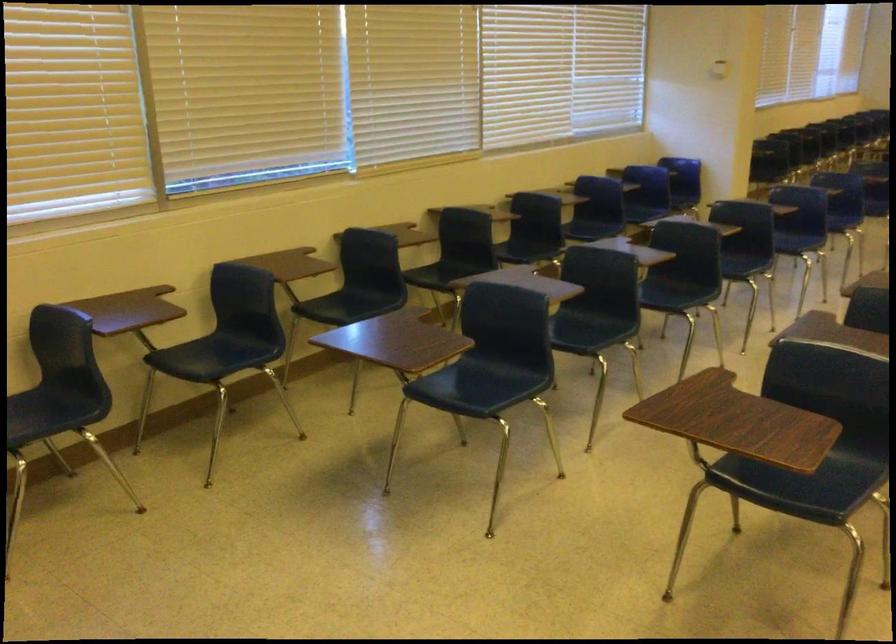
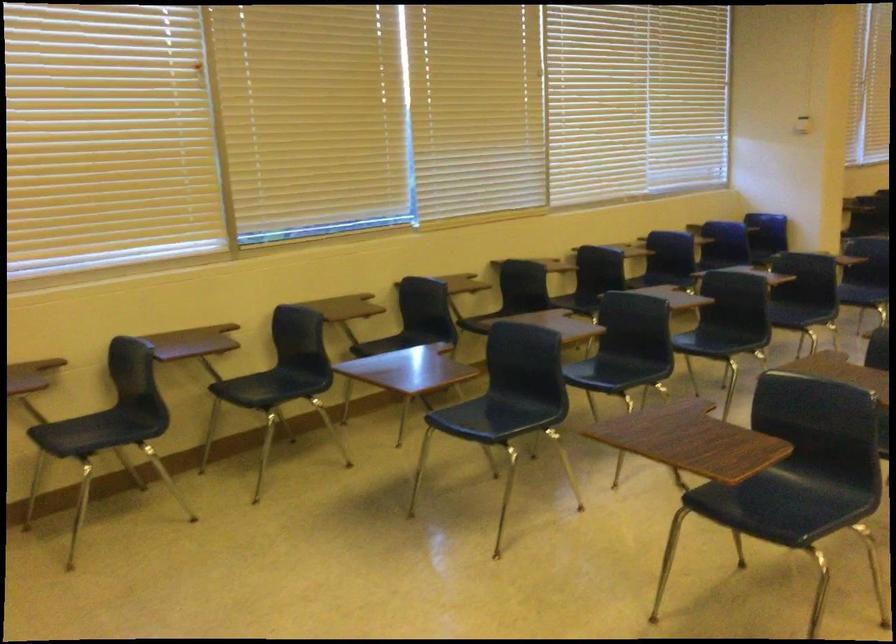
Question: The camera is either moving clockwise (left) or counter-clockwise (right) around the object. The first image is from the beginning of the video and the second image is from the end. Is the camera moving left or right when shooting the video?

Choices:
 (A) Left
 (B) Right

Answer: (B)